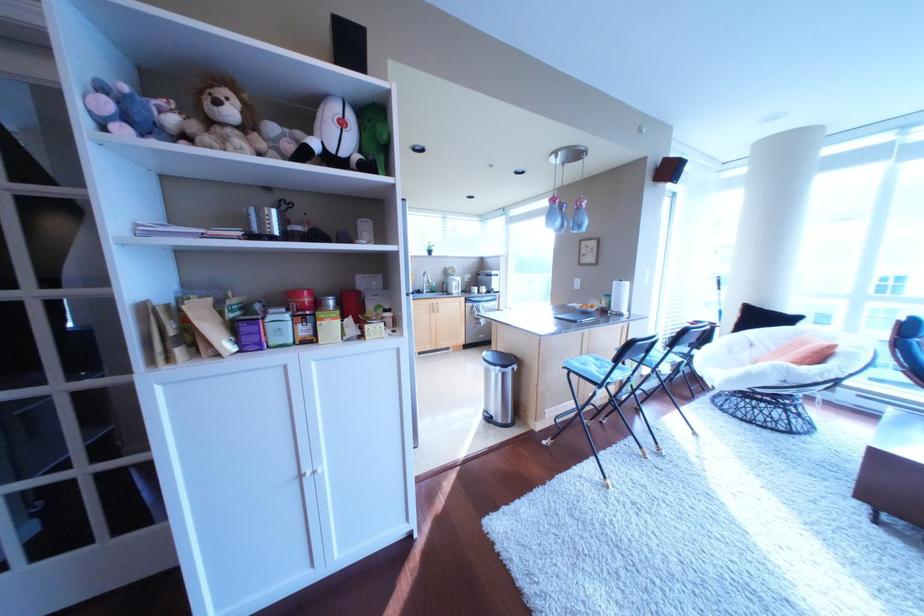
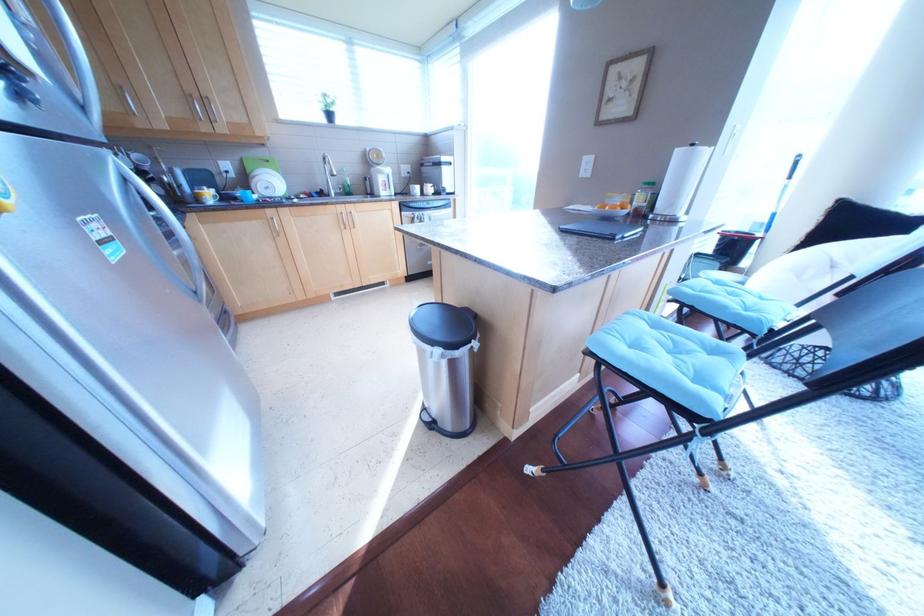
Question: What movement of the cameraman would produce the second image?

Choices:
 (A) Left
 (B) Right
 (C) Forward
 (D) Backward

Answer: (C)